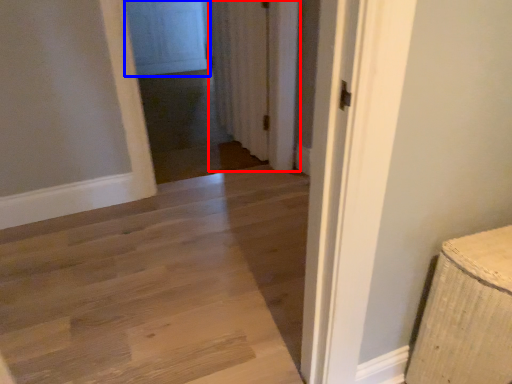
Question: Which object appears closest to the camera in this image, curtain (highlighted by a red box) or screen door (highlighted by a blue box)?

Choices:
 (A) curtain
 (B) screen door

Answer: (A)